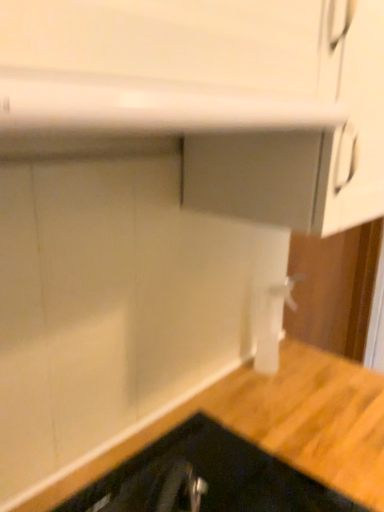
The image size is (384, 512). What do you see at coordinates (277, 424) in the screenshot?
I see `wooden at lower left` at bounding box center [277, 424].

Find the location of a particular element. The width and height of the screenshot is (384, 512). wooden at lower left is located at coordinates (277, 424).

In order to face wooden at lower left, should I rotate leftwards or rightwards?

Rotate your view right by about 2.006°.

What is the approximate width of wooden at lower left?

The width of wooden at lower left is 16.45 inches.

You are a GUI agent. You are given a task and a screenshot of the screen. Output one action in this format:
    pyautogui.click(x=<x>, y=<y>)
    Task: Click on the wooden at lower left
    The width and height of the screenshot is (384, 512).
    Given the screenshot: What is the action you would take?
    pyautogui.click(x=277, y=424)